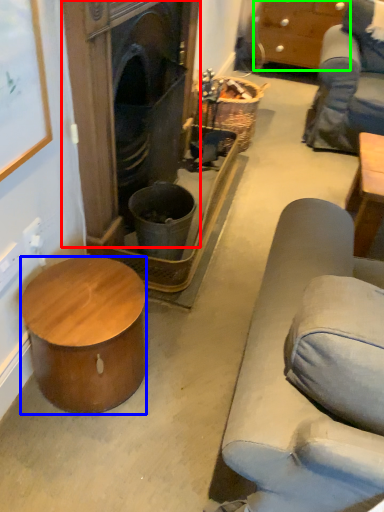
Question: Based on their relative distances, which object is farther from fireplace (highlighted by a red box)? Choose from desk (highlighted by a blue box) and cabinetry (highlighted by a green box).

Choices:
 (A) desk
 (B) cabinetry

Answer: (B)